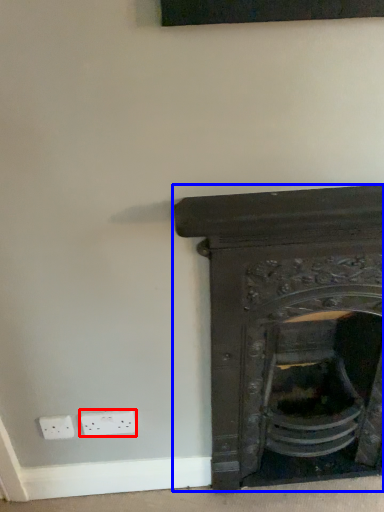
Question: Among these objects, which one is farthest to the camera, electric outlet (highlighted by a red box) or fireplace (highlighted by a blue box)?

Choices:
 (A) electric outlet
 (B) fireplace

Answer: (A)